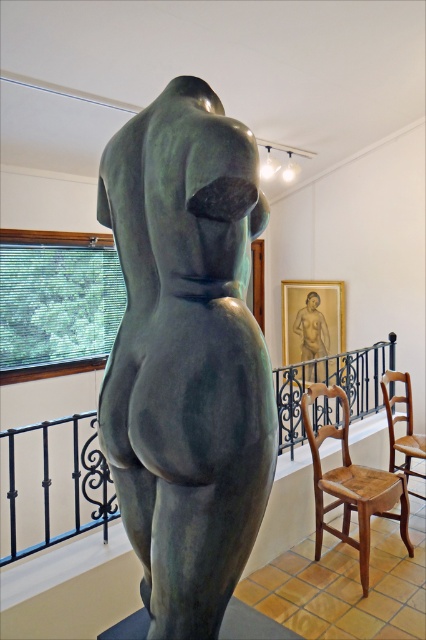
Is dark green metal balustrade at center positioned at the back of matte bronze statue at center?

No, dark green metal balustrade at center is closer to the viewer.

The width and height of the screenshot is (426, 640). Describe the element at coordinates (71, 477) in the screenshot. I see `dark green metal balustrade at center` at that location.

The image size is (426, 640). Describe the element at coordinates (71, 477) in the screenshot. I see `dark green metal balustrade at center` at that location.

Image resolution: width=426 pixels, height=640 pixels. Identify the location of dark green metal balustrade at center. (71, 477).

Does bronze statue at center appear on the right side of wooden chair at lower right?

In fact, bronze statue at center is to the left of wooden chair at lower right.

Is bronze statue at center shorter than wooden chair at lower right?

Incorrect, bronze statue at center's height does not fall short of wooden chair at lower right's.

Identify the location of bronze statue at center. The height and width of the screenshot is (640, 426). (187, 355).

Locate an element on the screen. bronze statue at center is located at coordinates (187, 355).

Which of these two, bronze statue at center or matte bronze statue at center, stands shorter?

Standing shorter between the two is matte bronze statue at center.

Is point (173, 323) positioned after point (324, 332)?

No, it is in front of (324, 332).

This screenshot has height=640, width=426. Find the location of `bronze statue at center`. bronze statue at center is located at coordinates (187, 355).